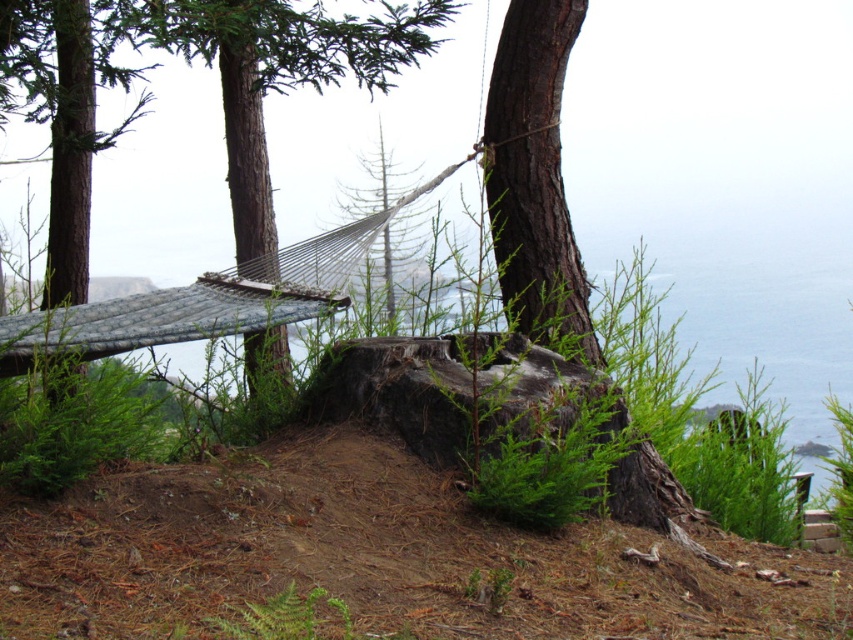
Question: Can you confirm if brown rough tree trunk at center is positioned below brown rough tree trunk at upper center?

Choices:
 (A) no
 (B) yes

Answer: (B)

Question: Can you confirm if brown rough wood at left is smaller than brown rough tree trunk at upper center?

Choices:
 (A) no
 (B) yes

Answer: (A)

Question: Which of the following is the farthest from the observer?

Choices:
 (A) brown rough wood at left
 (B) brown rough tree trunk at upper center
 (C) green textured hammock at center
 (D) brown rough tree trunk at center

Answer: (B)

Question: Which object is the farthest from the brown rough tree trunk at upper center?

Choices:
 (A) brown rough tree trunk at center
 (B) brown rough wood at left

Answer: (A)

Question: Which of these objects is positioned farthest from the brown rough wood at left?

Choices:
 (A) green textured hammock at center
 (B) brown rough tree trunk at center
 (C) brown rough tree trunk at upper center

Answer: (B)

Question: Does brown rough tree trunk at center have a smaller size compared to brown rough wood at left?

Choices:
 (A) yes
 (B) no

Answer: (A)